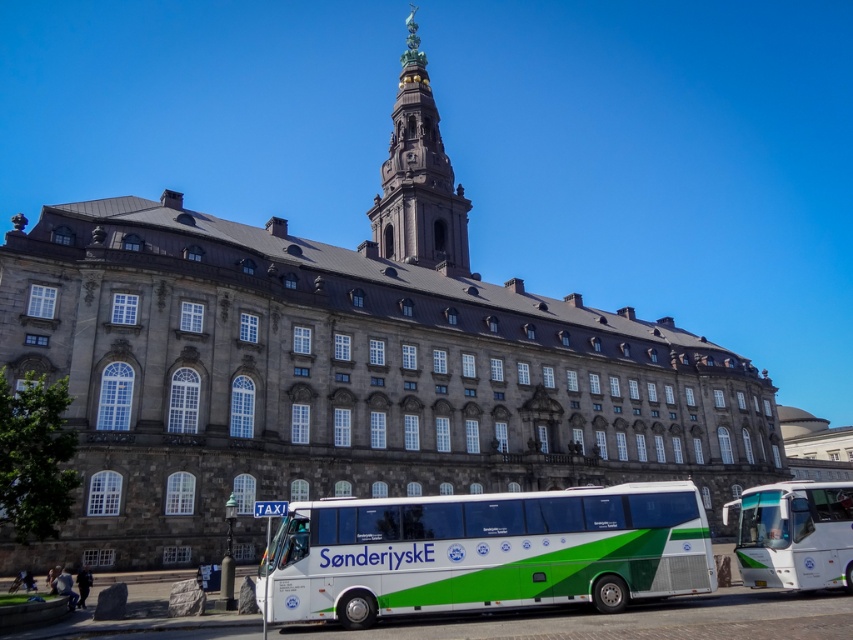
Question: Where is dark gray stone tower at upper center located in relation to white glossy bus at right in the image?

Choices:
 (A) right
 (B) left

Answer: (B)

Question: Can you confirm if white/green painted bus at lower center is smaller than dark gray stone tower at upper center?

Choices:
 (A) yes
 (B) no

Answer: (A)

Question: Is white/green painted bus at lower center to the right of white glossy bus at right from the viewer's perspective?

Choices:
 (A) no
 (B) yes

Answer: (A)

Question: Which object appears closest to the camera in this image?

Choices:
 (A) dark gray stone tower at upper center
 (B) white/green painted bus at lower center
 (C) white glossy bus at right

Answer: (B)

Question: Which object is farther from the camera taking this photo?

Choices:
 (A) dark gray stone tower at upper center
 (B) white glossy bus at right
 (C) white/green painted bus at lower center

Answer: (A)

Question: Which object is closer to the camera taking this photo?

Choices:
 (A) white/green painted bus at lower center
 (B) white glossy bus at right

Answer: (A)